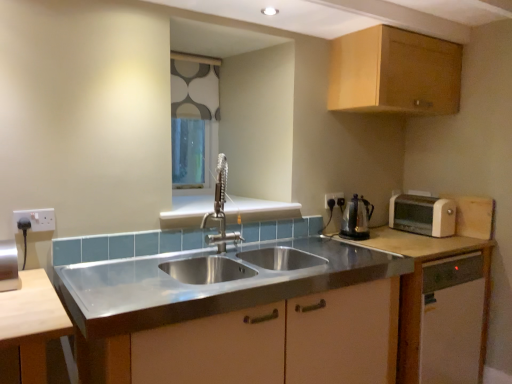
Question: Considering the relative sizes of shiny metallic kettle at right and white matte cabinet at right, which appears as the third cabinetry when viewed from the top, in the image provided, is shiny metallic kettle at right taller than white matte cabinet at right, which appears as the third cabinetry when viewed from the top,?

Choices:
 (A) yes
 (B) no

Answer: (B)

Question: Is shiny metallic kettle at right positioned beyond the bounds of white matte cabinet at right, the first cabinetry from the bottom?

Choices:
 (A) no
 (B) yes

Answer: (B)

Question: Is shiny metallic kettle at right behind white matte cabinet at right, the first cabinetry from the bottom?

Choices:
 (A) no
 (B) yes

Answer: (B)

Question: Does shiny metallic kettle at right appear on the left side of white matte cabinet at right, the first cabinetry from the bottom?

Choices:
 (A) yes
 (B) no

Answer: (A)

Question: Considering the relative sizes of shiny metallic kettle at right and white matte cabinet at right, the first cabinetry from the bottom, in the image provided, is shiny metallic kettle at right shorter than white matte cabinet at right, the first cabinetry from the bottom,?

Choices:
 (A) yes
 (B) no

Answer: (A)

Question: Considering the relative sizes of shiny metallic kettle at right and white matte cabinet at right, the first cabinetry from the bottom, in the image provided, is shiny metallic kettle at right smaller than white matte cabinet at right, the first cabinetry from the bottom,?

Choices:
 (A) no
 (B) yes

Answer: (B)

Question: From the image's perspective, is stainless steel sink at center, marked as the 2th cabinetry in a top-to-bottom arrangement, under white fabric at upper center?

Choices:
 (A) no
 (B) yes

Answer: (B)

Question: Is stainless steel sink at center, which is counted as the 2th cabinetry, starting from the bottom, at the left side of white fabric at upper center?

Choices:
 (A) no
 (B) yes

Answer: (A)

Question: Does stainless steel sink at center, marked as the 2th cabinetry in a top-to-bottom arrangement, come behind white fabric at upper center?

Choices:
 (A) yes
 (B) no

Answer: (B)

Question: Is stainless steel sink at center, marked as the 2th cabinetry in a top-to-bottom arrangement, to the right of white fabric at upper center from the viewer's perspective?

Choices:
 (A) no
 (B) yes

Answer: (B)

Question: Does stainless steel sink at center, marked as the 2th cabinetry in a top-to-bottom arrangement, have a greater width compared to white fabric at upper center?

Choices:
 (A) yes
 (B) no

Answer: (A)

Question: Does stainless steel sink at center, marked as the 2th cabinetry in a top-to-bottom arrangement, have a smaller size compared to white fabric at upper center?

Choices:
 (A) no
 (B) yes

Answer: (A)

Question: Is stainless steel sink at center, marked as the 2th cabinetry in a top-to-bottom arrangement, aimed at white matte cabinet at right, which appears as the third cabinetry when viewed from the top?

Choices:
 (A) yes
 (B) no

Answer: (B)